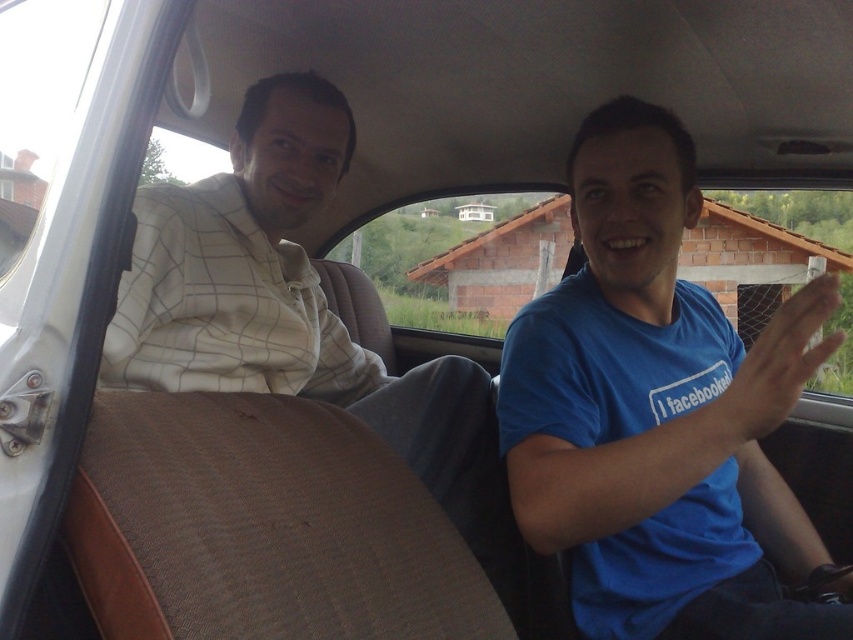
Image resolution: width=853 pixels, height=640 pixels. What do you see at coordinates (659, 412) in the screenshot?
I see `blue cotton shirt at center` at bounding box center [659, 412].

Is blue cotton shirt at center to the right of white checkered shirt at center from the viewer's perspective?

Yes, blue cotton shirt at center is to the right of white checkered shirt at center.

This screenshot has height=640, width=853. I want to click on blue cotton shirt at center, so click(x=659, y=412).